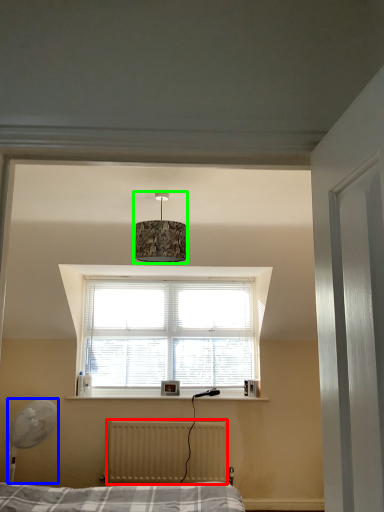
Question: Which is farther away from radiator (highlighted by a red box)? table lamp (highlighted by a blue box) or lamp (highlighted by a green box)?

Choices:
 (A) table lamp
 (B) lamp

Answer: (B)